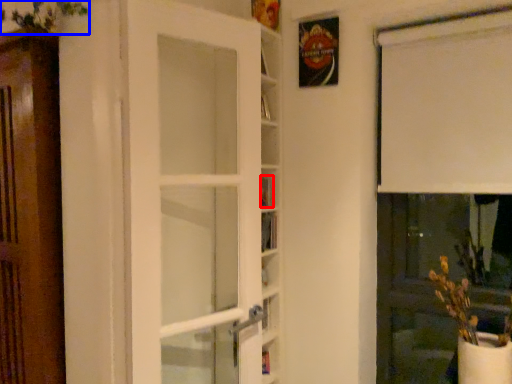
Question: Which of the following is the farthest to the observer, book (highlighted by a red box) or plant (highlighted by a blue box)?

Choices:
 (A) book
 (B) plant

Answer: (A)